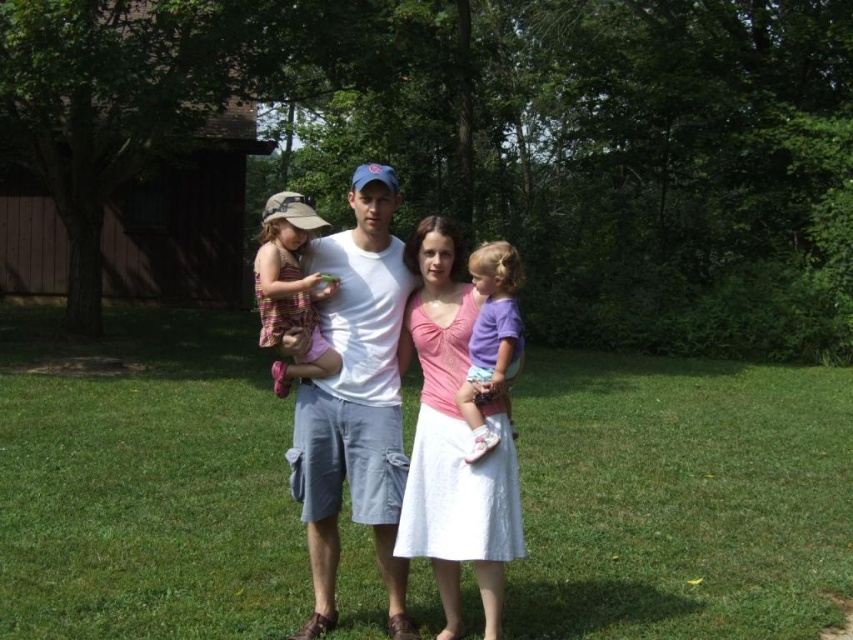
You are a photographer trying to capture a family photo. You notice the green grass at center and the striped fabric dress at left in the scene. Which object is located to the left of the other?

The green grass at center is positioned on the left side of striped fabric dress at left.